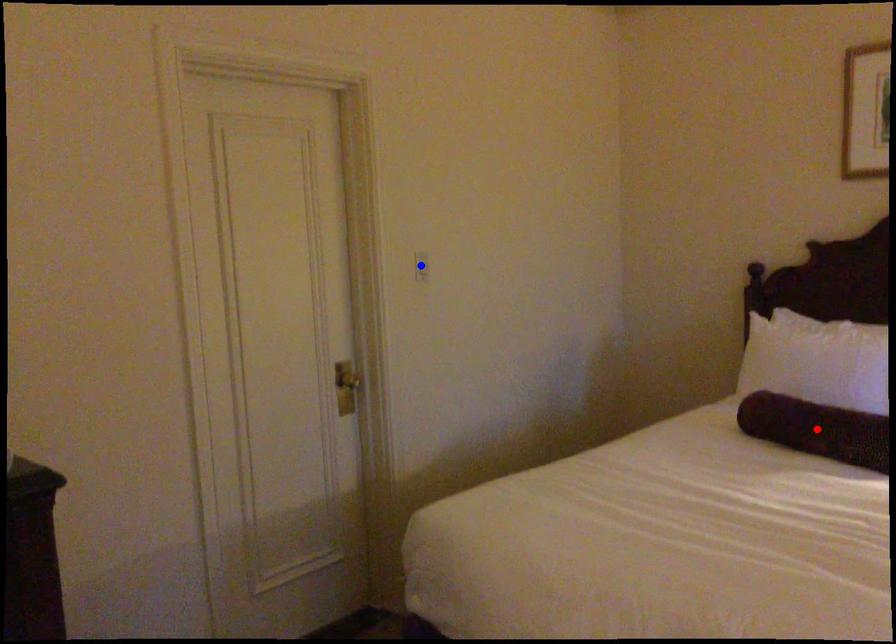
Question: Two points are marked on the image. Which point is closer to the camera?

Choices:
 (A) Blue point is closer.
 (B) Red point is closer.

Answer: (B)